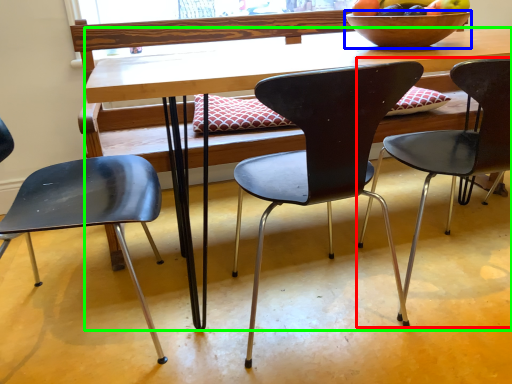
Question: Estimate the real-world distances between objects in this image. Which object is closer to chair (highlighted by a red box), bowl (highlighted by a blue box) or desk (highlighted by a green box)?

Choices:
 (A) bowl
 (B) desk

Answer: (A)